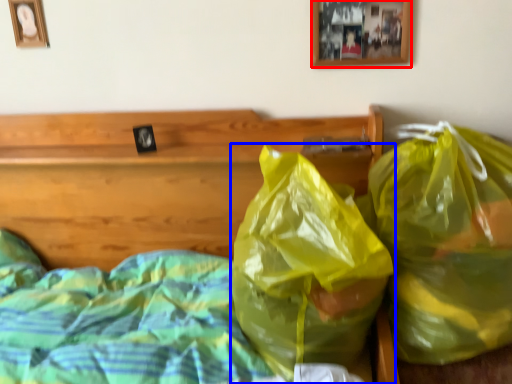
Question: Which object is further to the camera taking this photo, picture frame (highlighted by a red box) or plastic bag (highlighted by a blue box)?

Choices:
 (A) picture frame
 (B) plastic bag

Answer: (A)